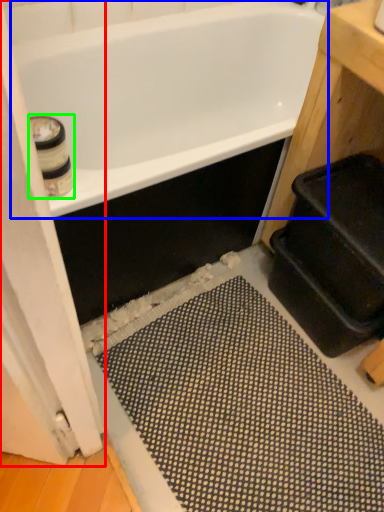
Question: Which object is the farthest from screen door (highlighted by a red box)? Choose among these: bathtub (highlighted by a blue box) or toilet paper (highlighted by a green box).

Choices:
 (A) bathtub
 (B) toilet paper

Answer: (A)